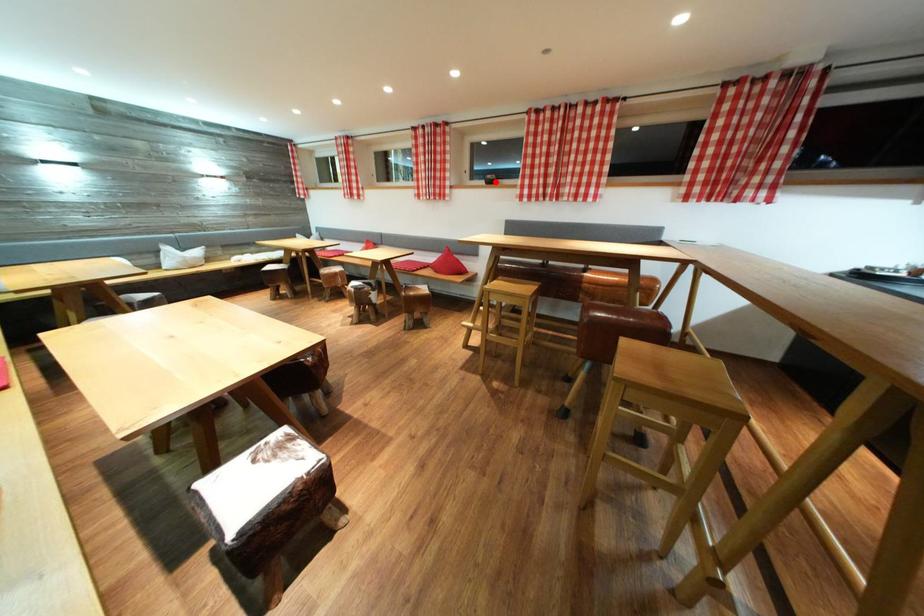
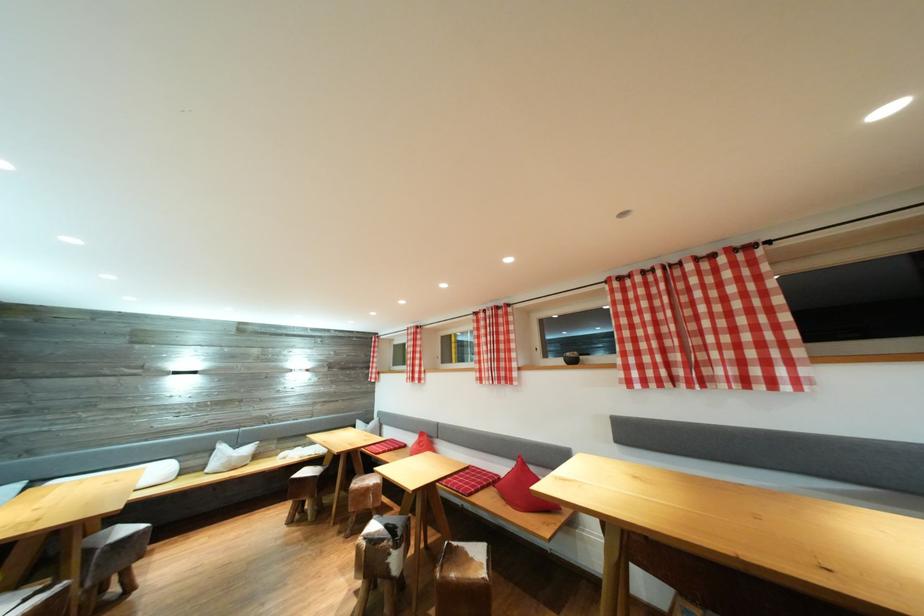
In the second image, find the point that corresponds to the highlighted location in the first image.

(575, 360)